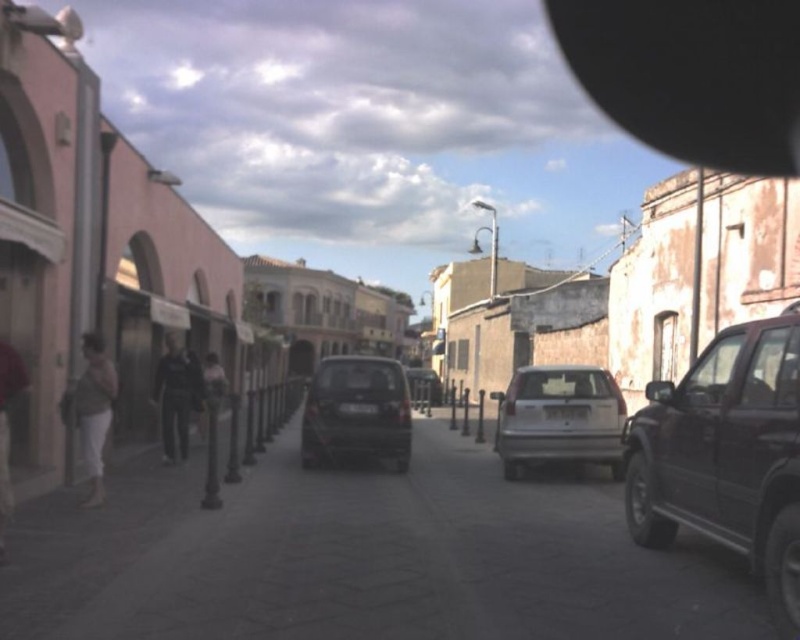
You are a delivery person trying to park your small van in the narrow street. You see the dark gray suv at right and the matte gray pants at lower left. Which vehicle should you avoid parking next to to ensure enough space?

You should avoid parking next to the dark gray suv at right because it is larger than the matte gray pants at lower left, leaving less space for your van.

You are a delivery person standing at the matte gray pants at lower left, and you need to reach the dark gray suv at right to load packages. The delivery cart you are using is 1.5 meters wide. Is there enough space between the two objects to maneuver the cart through?

The dark gray suv at right is 6.12 meters away from the matte gray pants at lower left. Since the delivery cart is only 1.5 meters wide, there is sufficient space to maneuver the cart between the two objects as the distance is much greater than the cart width.

You are a delivery driver who needs to park your vehicle in this narrow street. You see the dark gray suv at right and the shiny dark gray car at center. Which vehicle is blocking your path if you want to exit the street from the right side?

The dark gray suv at right is blocking your path because it is in front of the shiny dark gray car at center, making it harder to exit from the right side.